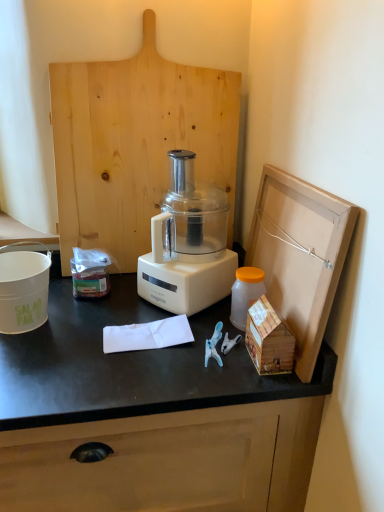
This screenshot has height=512, width=384. Describe the element at coordinates (135, 144) in the screenshot. I see `natural wood cutting board at center, the 2th wood in the right-to-left sequence` at that location.

How much space does natural wood cutting board at center, acting as the 1th wood starting from the top, occupy vertically?

The height of natural wood cutting board at center, acting as the 1th wood starting from the top, is 34.13 inches.

You are a GUI agent. You are given a task and a screenshot of the screen. Output one action in this format:
    pyautogui.click(x=<x>, y=<y>)
    Task: Click on the white matte salad pail at left
    This screenshot has height=512, width=384.
    Given the screenshot: What is the action you would take?
    pyautogui.click(x=23, y=290)

What is the approximate width of white plastic blender at center?

white plastic blender at center is 13.11 inches wide.

Describe the element at coordinates (188, 244) in the screenshot. The width and height of the screenshot is (384, 512). I see `white plastic blender at center` at that location.

The width and height of the screenshot is (384, 512). Describe the element at coordinates (90, 273) in the screenshot. I see `translucent plastic container at center-left` at that location.

What do you see at coordinates (245, 293) in the screenshot?
I see `translucent plastic bottle at right` at bounding box center [245, 293].

What do you see at coordinates (268, 339) in the screenshot? Image resolution: width=384 pixels, height=512 pixels. I see `wooden house at right, which is the 1th wood in bottom-to-top order` at bounding box center [268, 339].

Find the location of a particular element. This screenshot has width=384, height=512. natural wood cutting board at center, acting as the 2th wood starting from the bottom is located at coordinates (x=135, y=144).

Between wooden house at right, which ranks as the second wood in top-to-bottom order, and white plastic blender at center, which one has larger size?

Bigger between the two is white plastic blender at center.

Would you say wooden house at right, the 1th wood in the front-to-back sequence, contains white plastic blender at center?

Definitely not — white plastic blender at center is not inside wooden house at right, the 1th wood in the front-to-back sequence.

Is wooden house at right, marked as the first wood in a right-to-left arrangement, taller or shorter than white plastic blender at center?

Considering their sizes, wooden house at right, marked as the first wood in a right-to-left arrangement, has less height than white plastic blender at center.

Is natural wood cutting board at center, which appears as the first wood when viewed from the left, taller or shorter than translucent plastic bottle at right?

Clearly, natural wood cutting board at center, which appears as the first wood when viewed from the left, is taller compared to translucent plastic bottle at right.

Considering the points (148, 194) and (245, 323), which point is in front, point (148, 194) or point (245, 323)?

Positioned in front is point (245, 323).

Is natural wood cutting board at center, the 2th wood when ordered from front to back, with translucent plastic bottle at right?

natural wood cutting board at center, the 2th wood when ordered from front to back, is not next to translucent plastic bottle at right, and they're not touching.

Is natural wood cutting board at center, the 2th wood in the right-to-left sequence, to the left of translucent plastic bottle at right from the viewer's perspective?

Yes, natural wood cutting board at center, the 2th wood in the right-to-left sequence, is to the left of translucent plastic bottle at right.

Is translucent plastic container at center-left located outside natural wood cutting board at center, which is counted as the 1th wood, starting from the back?

Yes.

Does translucent plastic container at center-left come behind natural wood cutting board at center, the 2th wood when ordered from front to back?

Yes, translucent plastic container at center-left is further from the viewer.

From their relative heights in the image, would you say translucent plastic container at center-left is taller or shorter than natural wood cutting board at center, acting as the 2th wood starting from the bottom?

translucent plastic container at center-left is shorter than natural wood cutting board at center, acting as the 2th wood starting from the bottom.

Can you confirm if translucent plastic container at center-left is positioned to the right of natural wood cutting board at center, the 2th wood when ordered from front to back?

No.

Does point (217, 231) appear closer or farther from the camera than point (65, 273)?

Clearly, point (217, 231) is more distant from the camera than point (65, 273).

Looking at this image, is natural wood cutting board at center, which is counted as the 1th wood, starting from the back, inside white plastic blender at center?

No, white plastic blender at center does not contain natural wood cutting board at center, which is counted as the 1th wood, starting from the back.

From a real-world perspective, which is physically below, white plastic blender at center or natural wood cutting board at center, the 2th wood in the right-to-left sequence?

From a 3D spatial view, white plastic blender at center is below.

Which is behind, white plastic blender at center or natural wood cutting board at center, which is counted as the 1th wood, starting from the back?

Positioned behind is natural wood cutting board at center, which is counted as the 1th wood, starting from the back.

Is wooden house at right, which is the 1th wood in bottom-to-top order, behind white matte salad pail at left?

No, wooden house at right, which is the 1th wood in bottom-to-top order, is closer to the camera.

From a real-world perspective, is wooden house at right, marked as the 2th wood in a back-to-front arrangement, physically below white matte salad pail at left?

Indeed, from a real-world perspective, wooden house at right, marked as the 2th wood in a back-to-front arrangement, is positioned beneath white matte salad pail at left.

From the image's perspective, is wooden house at right, marked as the 2th wood in a back-to-front arrangement, on white matte salad pail at left?

Actually, wooden house at right, marked as the 2th wood in a back-to-front arrangement, appears below white matte salad pail at left in the image.

Is wooden house at right, marked as the first wood in a right-to-left arrangement, in front of or behind natural wood cutting board at center, the 2th wood in the right-to-left sequence, in the image?

wooden house at right, marked as the first wood in a right-to-left arrangement, is positioned closer to the viewer than natural wood cutting board at center, the 2th wood in the right-to-left sequence.

Between point (263, 319) and point (97, 200), which one is positioned behind?

Point (97, 200)

Does wooden house at right, marked as the 2th wood in a back-to-front arrangement, have a lesser width compared to natural wood cutting board at center, which appears as the first wood when viewed from the left?

No, wooden house at right, marked as the 2th wood in a back-to-front arrangement, is not thinner than natural wood cutting board at center, which appears as the first wood when viewed from the left.

Is wooden house at right, which is the 1th wood in bottom-to-top order, looking in the opposite direction of translucent plastic bottle at right?

Yes, wooden house at right, which is the 1th wood in bottom-to-top order, is positioned with its back facing translucent plastic bottle at right.

In terms of height, does wooden house at right, which ranks as the second wood in top-to-bottom order, look taller or shorter compared to translucent plastic bottle at right?

wooden house at right, which ranks as the second wood in top-to-bottom order, is shorter than translucent plastic bottle at right.

Looking at their sizes, would you say wooden house at right, which is the 1th wood in bottom-to-top order, is wider or thinner than translucent plastic bottle at right?

wooden house at right, which is the 1th wood in bottom-to-top order, is wider than translucent plastic bottle at right.

Is wooden house at right, marked as the 2th wood in a back-to-front arrangement, to the left of translucent plastic bottle at right from the viewer's perspective?

No.

In the image, there is a white plastic blender at center. Identify the location of wood below it (from the image's perspective). The image size is (384, 512). (268, 339).

Where is `wood above the translucent plastic bottle at right (from the image's perspective)`? wood above the translucent plastic bottle at right (from the image's perspective) is located at coordinates (135, 144).

Looking at the image, which one is located closer to natural wood cutting board at center, which is counted as the 1th wood, starting from the back, white plastic blender at center or white matte salad pail at left?

Based on the image, white plastic blender at center appears to be nearer to natural wood cutting board at center, which is counted as the 1th wood, starting from the back.

From the image, which object appears to be nearer to wooden house at right, marked as the first wood in a right-to-left arrangement, translucent plastic bottle at right or translucent plastic container at center-left?

translucent plastic bottle at right.

Looking at the image, which one is located further to wooden house at right, which is the second wood in left-to-right order, white plastic blender at center or translucent plastic container at center-left?

translucent plastic container at center-left.

Looking at the image, which one is located further to translucent plastic bottle at right, translucent plastic container at center-left or white matte salad pail at left?

Based on the image, white matte salad pail at left appears to be further to translucent plastic bottle at right.

Estimate the real-world distances between objects in this image. Which object is further from white plastic blender at center, translucent plastic bottle at right or white matte salad pail at left?

white matte salad pail at left is positioned further to the anchor white plastic blender at center.

Estimate the real-world distances between objects in this image. Which object is closer to white plastic blender at center, wooden house at right, marked as the first wood in a right-to-left arrangement, or translucent plastic container at center-left?

translucent plastic container at center-left is closer to white plastic blender at center.

Which object lies further to the anchor point white matte salad pail at left, wooden house at right, marked as the first wood in a right-to-left arrangement, or white plastic blender at center?

wooden house at right, marked as the first wood in a right-to-left arrangement, is further to white matte salad pail at left.

Based on their spatial positions, is white matte salad pail at left or wooden house at right, which is the 1th wood in bottom-to-top order, further from translucent plastic container at center-left?

wooden house at right, which is the 1th wood in bottom-to-top order, is positioned further to the anchor translucent plastic container at center-left.

Identify the location of waste between white matte salad pail at left and white plastic blender at center in the horizontal direction. The height and width of the screenshot is (512, 384). (90, 273).

This screenshot has width=384, height=512. I want to click on waste located between white matte salad pail at left and wooden house at right, marked as the first wood in a right-to-left arrangement, in the left-right direction, so 90,273.

You are a GUI agent. You are given a task and a screenshot of the screen. Output one action in this format:
    pyautogui.click(x=<x>, y=<y>)
    Task: Click on the wood located between white matte salad pail at left and white plastic blender at center in the left-right direction
    
    Given the screenshot: What is the action you would take?
    [x=135, y=144]

You are a GUI agent. You are given a task and a screenshot of the screen. Output one action in this format:
    pyautogui.click(x=<x>, y=<y>)
    Task: Click on the blender located between translucent plastic container at center-left and translucent plastic bottle at right in the left-right direction
    This screenshot has height=512, width=384.
    Given the screenshot: What is the action you would take?
    pyautogui.click(x=188, y=244)